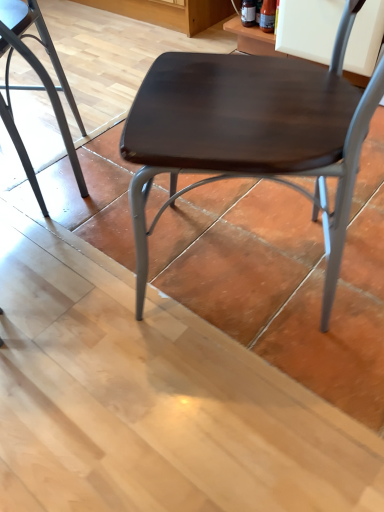
Question: Choose the correct answer: Is dark wood/matte chair at center, acting as the second chair starting from the left, inside metallic gray chair at lower left, which appears as the 1th chair when viewed from the left, or outside it?

Choices:
 (A) inside
 (B) outside

Answer: (B)

Question: Considering the positions of dark wood/matte chair at center, acting as the second chair starting from the left, and metallic gray chair at lower left, which ranks as the second chair in right-to-left order, in the image, is dark wood/matte chair at center, acting as the second chair starting from the left, bigger or smaller than metallic gray chair at lower left, which ranks as the second chair in right-to-left order,?

Choices:
 (A) big
 (B) small

Answer: (A)

Question: From the image's perspective, is dark wood/matte chair at center, acting as the second chair starting from the left, above or below metallic gray chair at lower left, which ranks as the second chair in right-to-left order?

Choices:
 (A) below
 (B) above

Answer: (A)

Question: In the image, is metallic gray chair at lower left, which ranks as the second chair in right-to-left order, on the left side or the right side of dark wood/matte chair at center, placed as the 1th chair when sorted from right to left?

Choices:
 (A) right
 (B) left

Answer: (B)

Question: Considering the positions of point (51, 96) and point (226, 69), is point (51, 96) closer or farther from the camera than point (226, 69)?

Choices:
 (A) farther
 (B) closer

Answer: (A)

Question: From the image's perspective, relative to dark wood/matte chair at center, placed as the 1th chair when sorted from right to left, is metallic gray chair at lower left, which appears as the 1th chair when viewed from the left, above or below?

Choices:
 (A) above
 (B) below

Answer: (A)

Question: Looking at the image, does metallic gray chair at lower left, which appears as the 1th chair when viewed from the left, seem bigger or smaller compared to dark wood/matte chair at center, acting as the second chair starting from the left?

Choices:
 (A) small
 (B) big

Answer: (A)